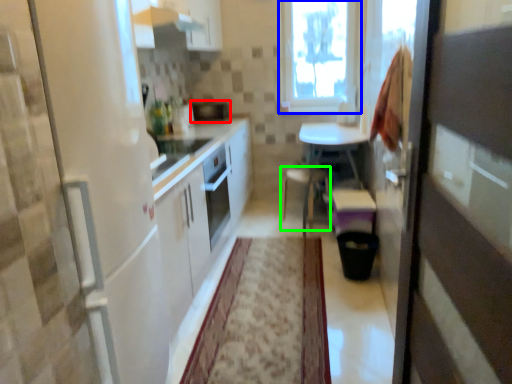
Question: Which is farther away from appliance (highlighted by a red box)? window (highlighted by a blue box) or chair (highlighted by a green box)?

Choices:
 (A) window
 (B) chair

Answer: (B)